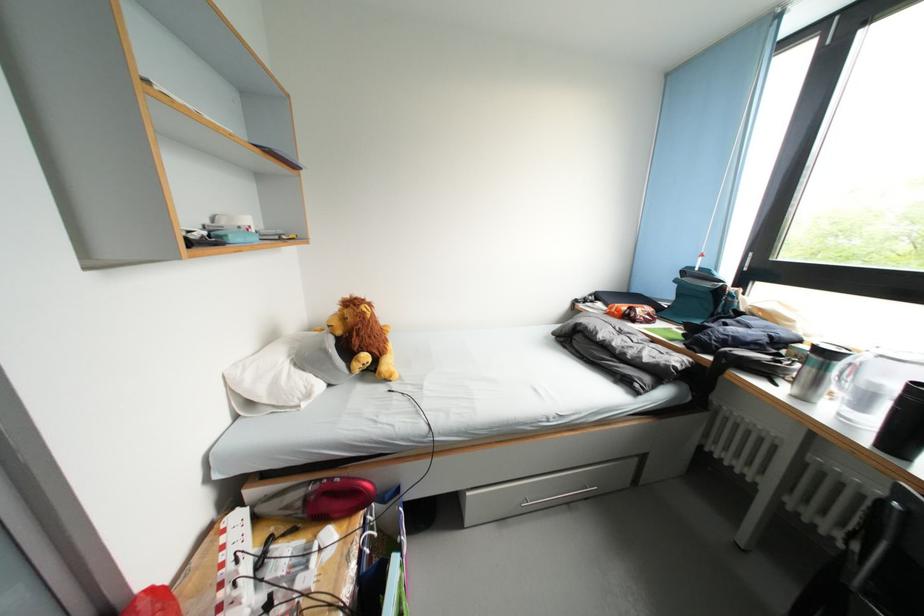
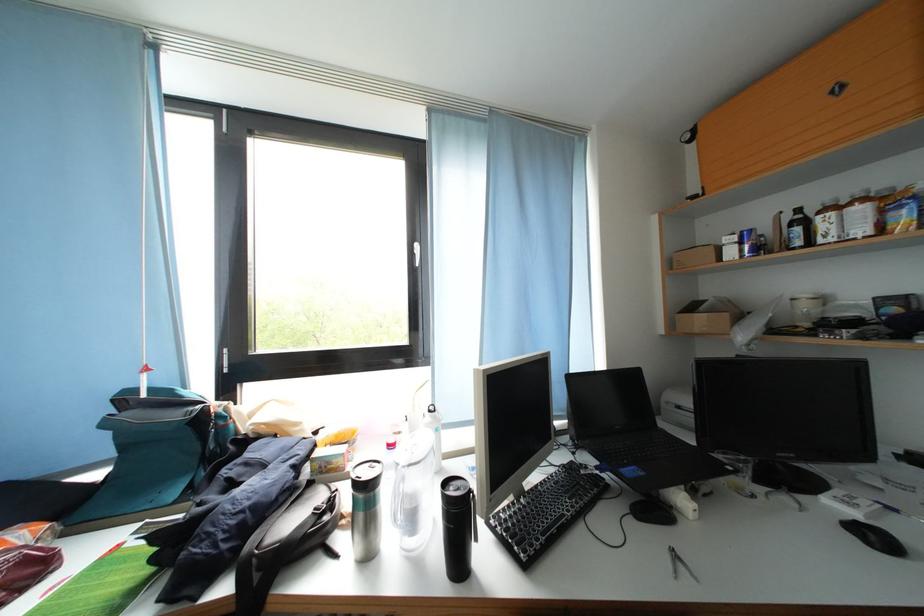
Question: The camera is either moving clockwise (left) or counter-clockwise (right) around the object. The first image is from the beginning of the video and the second image is from the end. Is the camera moving left or right when shooting the video?

Choices:
 (A) Left
 (B) Right

Answer: (A)